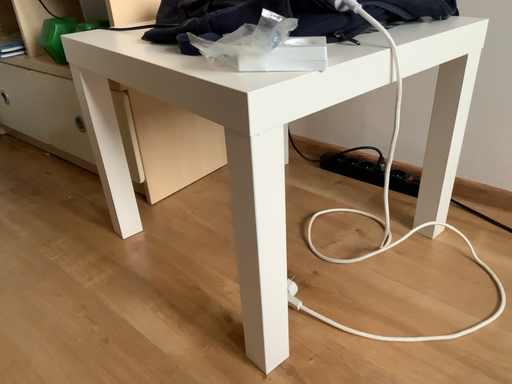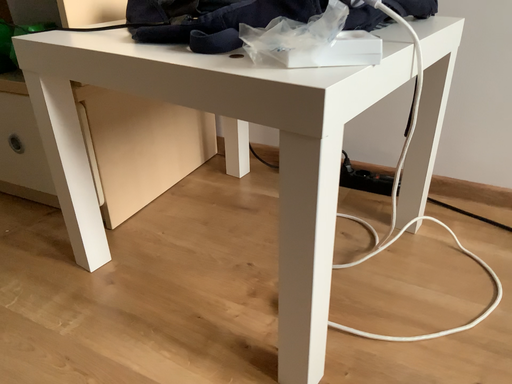
Question: How did the camera likely rotate when shooting the video?

Choices:
 (A) rotated left
 (B) rotated right

Answer: (B)